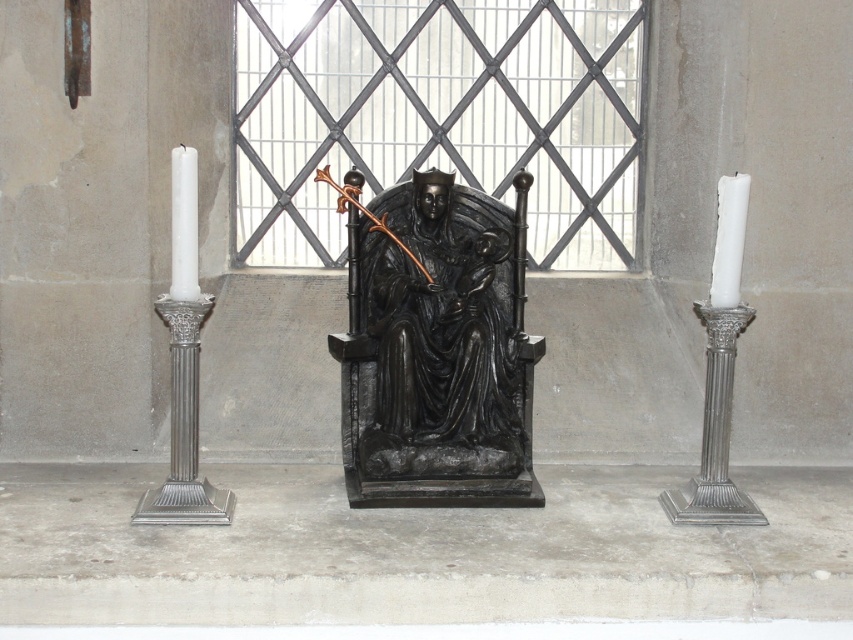
Can you confirm if metallic grid window at center is shorter than silver metallic candlestick at right?

No, metallic grid window at center is not shorter than silver metallic candlestick at right.

Who is lower down, metallic grid window at center or silver metallic candlestick at right?

Positioned lower is silver metallic candlestick at right.

Image resolution: width=853 pixels, height=640 pixels. What do you see at coordinates (440, 116) in the screenshot?
I see `metallic grid window at center` at bounding box center [440, 116].

Locate an element on the screen. This screenshot has height=640, width=853. metallic grid window at center is located at coordinates (440, 116).

Does black polished wood throne at center have a greater width compared to white matte candle at left?

Correct, the width of black polished wood throne at center exceeds that of white matte candle at left.

Can you confirm if black polished wood throne at center is shorter than white matte candle at left?

No, black polished wood throne at center is not shorter than white matte candle at left.

Between point (527, 417) and point (173, 234), which one is positioned behind?

Point (527, 417)

Where is `black polished wood throne at center`? black polished wood throne at center is located at coordinates (436, 348).

Is silver metallic candlestick at right to the left of white matte candle at right from the viewer's perspective?

Yes, silver metallic candlestick at right is to the left of white matte candle at right.

Is silver metallic candlestick at right thinner than white matte candle at right?

No, silver metallic candlestick at right is not thinner than white matte candle at right.

What do you see at coordinates (715, 433) in the screenshot? I see `silver metallic candlestick at right` at bounding box center [715, 433].

Find the location of `silver metallic candlestick at right`. silver metallic candlestick at right is located at coordinates (715, 433).